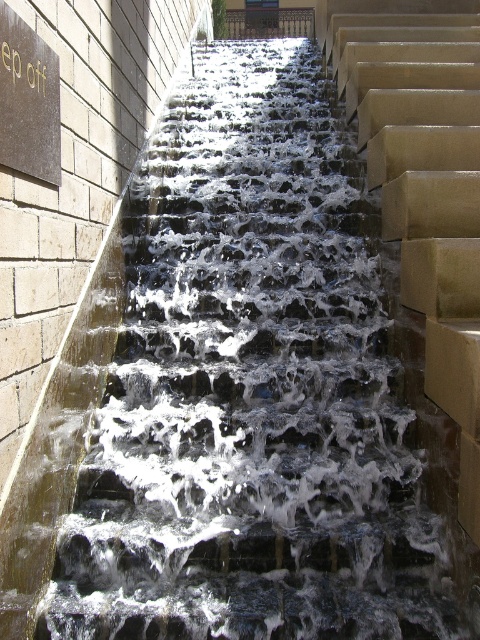
Measure the distance from satin gold stairs at upper center to matte black sign at upper left.

satin gold stairs at upper center is 9.84 feet from matte black sign at upper left.

Between satin gold stairs at upper center and matte black sign at upper left, which one has less height?

satin gold stairs at upper center is shorter.

Does point (414, 77) come closer to viewer compared to point (39, 81)?

No, (414, 77) is behind (39, 81).

This screenshot has height=640, width=480. I want to click on satin gold stairs at upper center, so click(x=425, y=198).

Is the position of matte black sign at upper left more distant than that of dark brown wrought iron at upper center?

No, matte black sign at upper left is closer to the viewer.

Which of these two, matte black sign at upper left or dark brown wrought iron at upper center, stands taller?

dark brown wrought iron at upper center is taller.

Which is in front, point (0, 72) or point (260, 13)?

Point (0, 72) is more forward.

Find the location of a particular element. The image size is (480, 640). matte black sign at upper left is located at coordinates (27, 100).

Is satin gold stairs at upper center further to the viewer compared to dark brown wrought iron at upper center?

No, it is not.

Can you confirm if satin gold stairs at upper center is thinner than dark brown wrought iron at upper center?

Yes, satin gold stairs at upper center is thinner than dark brown wrought iron at upper center.

You are a GUI agent. You are given a task and a screenshot of the screen. Output one action in this format:
    pyautogui.click(x=<x>, y=<y>)
    Task: Click on the satin gold stairs at upper center
    The height and width of the screenshot is (640, 480).
    Given the screenshot: What is the action you would take?
    pyautogui.click(x=425, y=198)